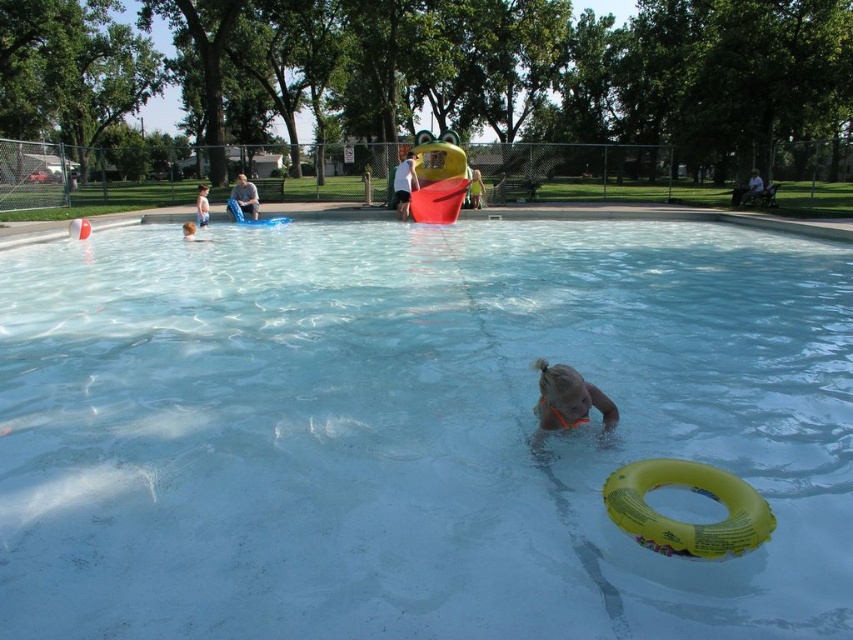
Does light brown wooden bench at upper center appear on the right side of yellow rubber ring at center?

Correct, you'll find light brown wooden bench at upper center to the right of yellow rubber ring at center.

Which of these two, light brown wooden bench at upper center or yellow rubber ring at center, stands taller?

light brown wooden bench at upper center is taller.

The image size is (853, 640). In order to click on light brown wooden bench at upper center in this screenshot , I will do `click(747, 189)`.

Is clear plastic pool at center taller than light blue fabric towel at upper left?

A: No.

Is clear plastic pool at center above light blue fabric towel at upper left?

Incorrect, clear plastic pool at center is not positioned above light blue fabric towel at upper left.

Who is more forward, (219,438) or (196,209)?

Point (219,438) is in front.

You are a GUI agent. You are given a task and a screenshot of the screen. Output one action in this format:
    pyautogui.click(x=<x>, y=<y>)
    Task: Click on the clear plastic pool at center
    The width and height of the screenshot is (853, 640).
    Given the screenshot: What is the action you would take?
    pyautogui.click(x=413, y=429)

Which of these two, white cotton shirt at upper center or yellow rubber ring at center, stands shorter?

yellow rubber ring at center is shorter.

Which is below, white cotton shirt at upper center or yellow rubber ring at center?

yellow rubber ring at center

Who is more forward, (413, 179) or (474, 176)?

Point (413, 179) is more forward.

The image size is (853, 640). Identify the location of white cotton shirt at upper center. (404, 184).